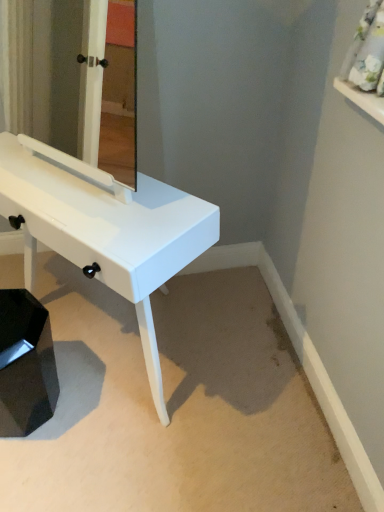
The width and height of the screenshot is (384, 512). In order to click on vacant space behind black glossy step stool at lower left in this screenshot , I will do pyautogui.click(x=72, y=341).